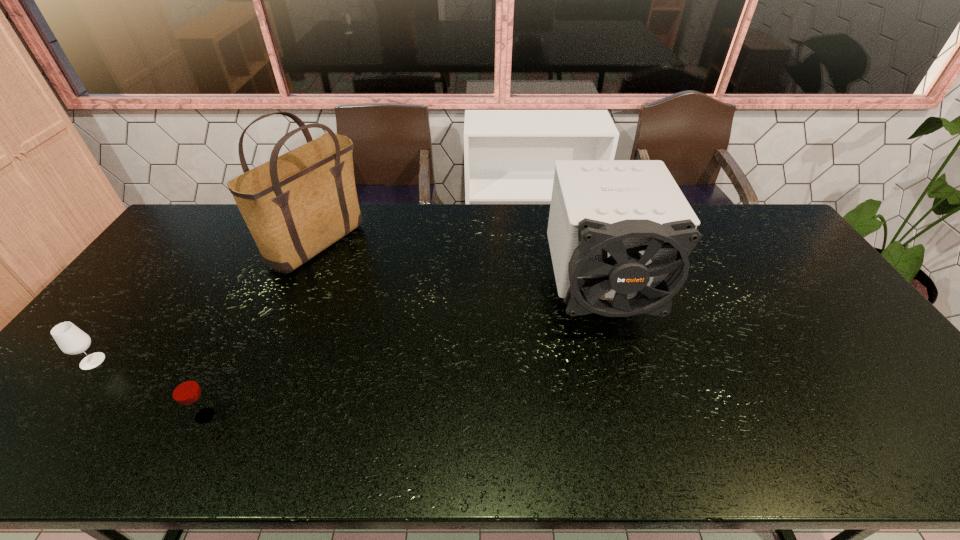
This screenshot has height=540, width=960. Identify the location of vacant space that's between the tote bag and the second tallest object. 459,269.

The height and width of the screenshot is (540, 960). What are the coordinates of `free space between the rightmost object and the nearest object` in the screenshot? It's located at (401, 356).

The height and width of the screenshot is (540, 960). What are the coordinates of `free spot between the tote bag and the left glass` in the screenshot? It's located at (205, 301).

The image size is (960, 540). I want to click on free area in between the rightmost object and the tote bag, so click(x=459, y=269).

Where is `free space between the tote bag and the left glass`? free space between the tote bag and the left glass is located at coordinates (205, 301).

The image size is (960, 540). I want to click on free area in between the third shortest object and the second nearest object, so click(x=346, y=328).

The width and height of the screenshot is (960, 540). I want to click on vacant area between the tote bag and the leftmost object, so click(x=205, y=301).

Where is `blank region between the leftmost object and the rightmost object`? blank region between the leftmost object and the rightmost object is located at coordinates (346, 328).

Locate an element on the screen. The image size is (960, 540). unoccupied position between the tote bag and the nearest object is located at coordinates (262, 329).

Where is `free spot between the tote bag and the fan`? This screenshot has width=960, height=540. free spot between the tote bag and the fan is located at coordinates (459, 269).